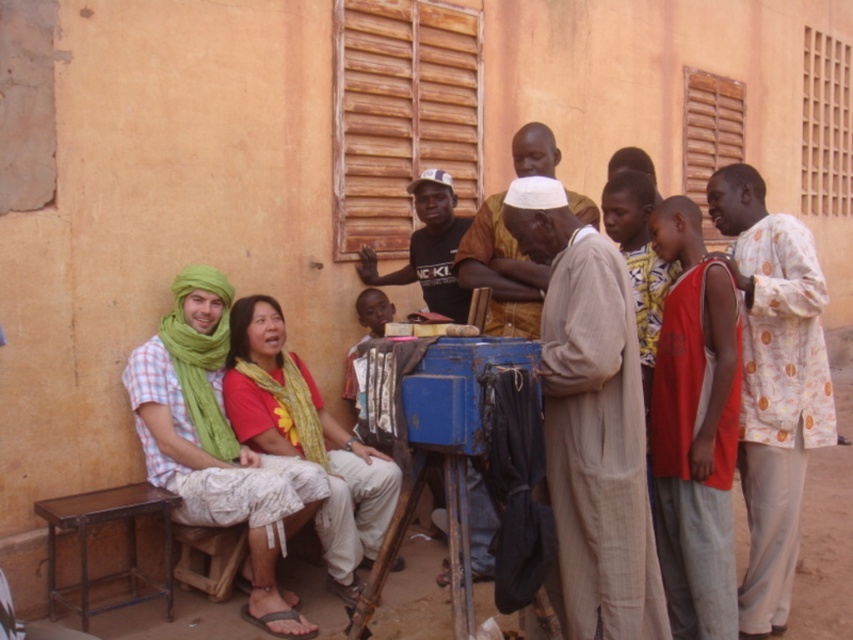
Question: Does light brown fabric at center have a larger size compared to wooden stool at lower left?

Choices:
 (A) yes
 (B) no

Answer: (A)

Question: Which point appears farthest from the camera in this image?

Choices:
 (A) (442, 531)
 (B) (314, 460)
 (C) (224, 595)

Answer: (A)

Question: Which object is the closest to the light beige fabric at center?

Choices:
 (A) printed cotton shirt at right
 (B) light brown fabric at center

Answer: (A)

Question: Is light brown fabric at center to the right of rustic wood stool at lower left from the viewer's perspective?

Choices:
 (A) no
 (B) yes

Answer: (B)

Question: Which object appears farthest from the camera in this image?

Choices:
 (A) light green fabric turban at left
 (B) yellow printed fabric at center
 (C) light beige fabric at center
 (D) red sleeveless shirt at right

Answer: (B)

Question: Can you confirm if printed cotton shirt at right is positioned below rustic wood stool at lower left?

Choices:
 (A) no
 (B) yes

Answer: (A)